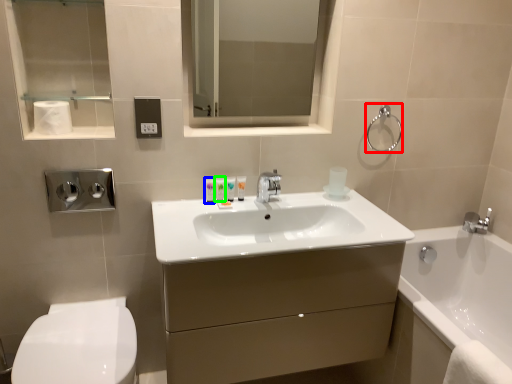
Question: Which object is positioned closest to towel bar (highlighted by a red box)? Select from toiletry (highlighted by a blue box) and toiletry (highlighted by a green box).

Choices:
 (A) toiletry
 (B) toiletry

Answer: (B)